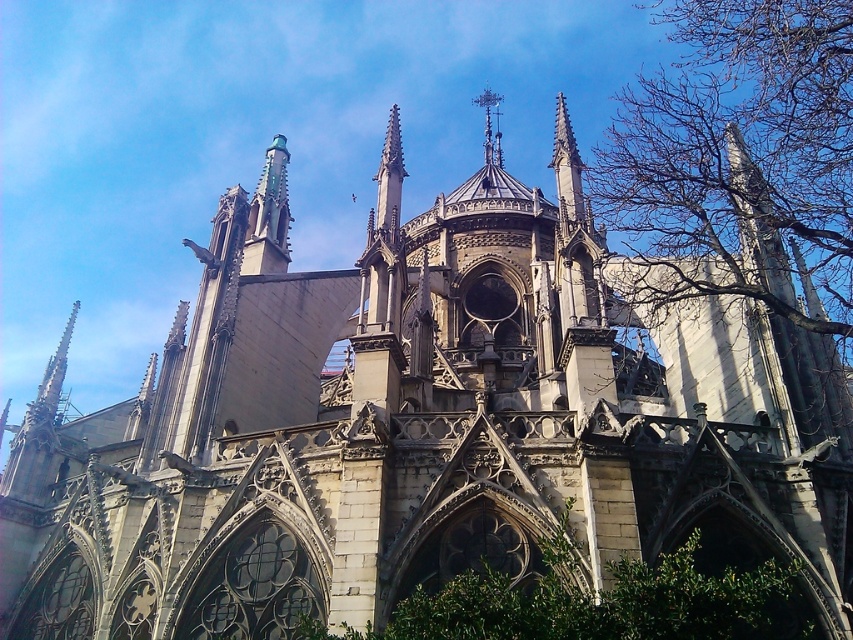
Question: Can you confirm if bare branches at upper right is thinner than green leafy bush at lower center?

Choices:
 (A) yes
 (B) no

Answer: (B)

Question: Which point appears farthest from the camera in this image?

Choices:
 (A) (827, 161)
 (B) (782, 608)

Answer: (A)

Question: Which object appears farthest from the camera in this image?

Choices:
 (A) bare branches at upper right
 (B) green leafy bush at lower center

Answer: (A)

Question: Is bare branches at upper right wider than green leafy bush at lower center?

Choices:
 (A) yes
 (B) no

Answer: (A)

Question: Is bare branches at upper right wider than green leafy bush at lower center?

Choices:
 (A) no
 (B) yes

Answer: (B)